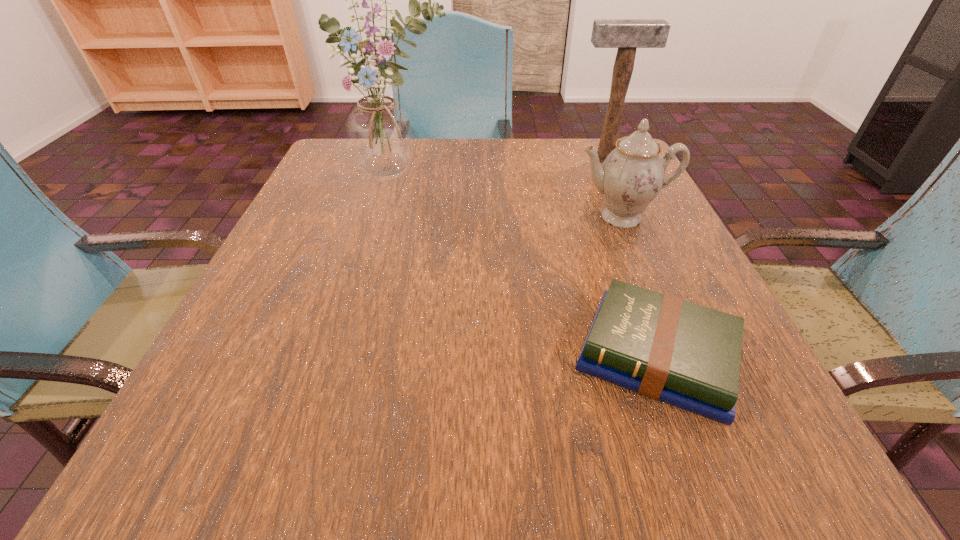
Where is `free spot located on the left of the book`? The height and width of the screenshot is (540, 960). free spot located on the left of the book is located at coordinates (329, 356).

At what (x,y) coordinates should I click in order to perform the action: click on bouquet situated at the far edge. Please return your answer as a coordinate pair (x, y). Image resolution: width=960 pixels, height=540 pixels. Looking at the image, I should click on (380, 134).

At what (x,y) coordinates should I click in order to perform the action: click on mallet located in the far edge section of the desktop. Please return your answer as a coordinate pair (x, y). Looking at the image, I should click on (627, 35).

In order to click on object at the near edge in this screenshot , I will do (x=687, y=355).

Image resolution: width=960 pixels, height=540 pixels. In order to click on object at the left edge in this screenshot , I will do `click(380, 134)`.

This screenshot has height=540, width=960. Identify the location of mallet situated at the right edge. (627, 35).

Locate an element on the screen. chinaware that is at the right edge is located at coordinates 632,175.

You are a GUI agent. You are given a task and a screenshot of the screen. Output one action in this format:
    pyautogui.click(x=<x>, y=<y>)
    Task: Click on the book positioned at the right edge
    This screenshot has width=960, height=540.
    Given the screenshot: What is the action you would take?
    [x=687, y=355]

This screenshot has width=960, height=540. In order to click on object that is at the far left corner in this screenshot , I will do `click(380, 134)`.

Find the location of a particular element. object located in the far right corner section of the desktop is located at coordinates (627, 35).